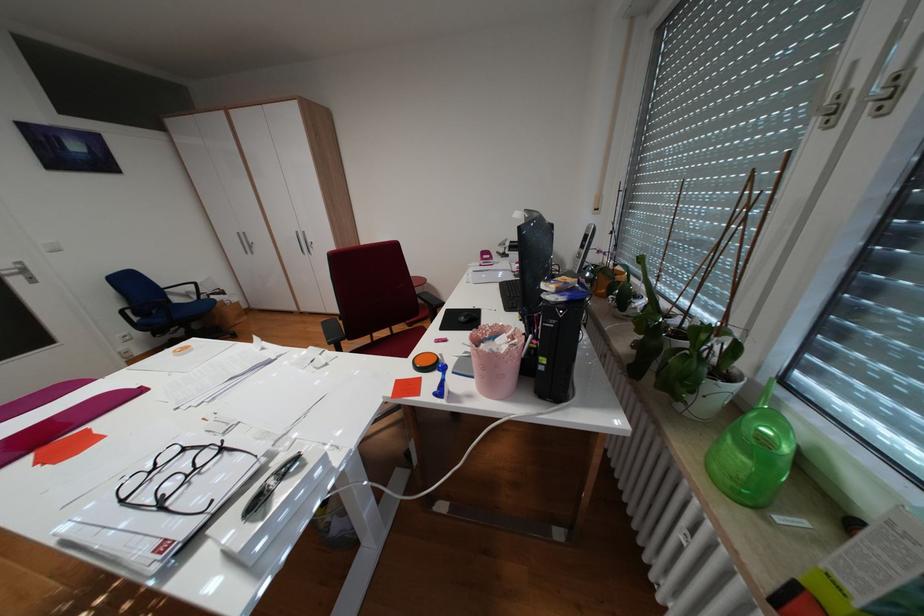
You are a GUI agent. You are given a task and a screenshot of the screen. Output one action in this format:
    pyautogui.click(x=<x>, y=<y>)
    Task: Click on the red chair armrest
    The height and width of the screenshot is (616, 924).
    Given the screenshot: What is the action you would take?
    pyautogui.click(x=419, y=315)